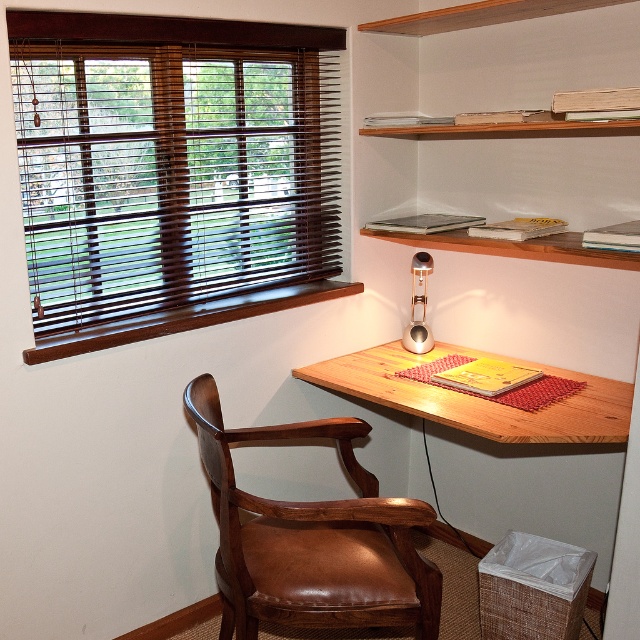
Question: Does wooden desk at center have a greater width compared to wooden shelves at upper right?

Choices:
 (A) yes
 (B) no

Answer: (A)

Question: Among these objects, which one is nearest to the camera?

Choices:
 (A) brown wood blinds at upper left
 (B) wooden shelves at upper right
 (C) wooden table at center
 (D) wooden desk at center

Answer: (A)

Question: Which object is the closest to the metallic gold desk lamp at upper right?

Choices:
 (A) wooden desk at center
 (B) wooden table at center
 (C) brown wood blinds at upper left
 (D) wooden shelves at upper right

Answer: (B)

Question: Can you confirm if wooden table at center is positioned above wooden desk at center?

Choices:
 (A) no
 (B) yes

Answer: (A)

Question: Is brown leather swivel chair at lower left to the right of metallic gold desk lamp at upper right from the viewer's perspective?

Choices:
 (A) yes
 (B) no

Answer: (B)

Question: Which of the following is the closest to the observer?

Choices:
 (A) (99, 340)
 (B) (486, 422)

Answer: (B)